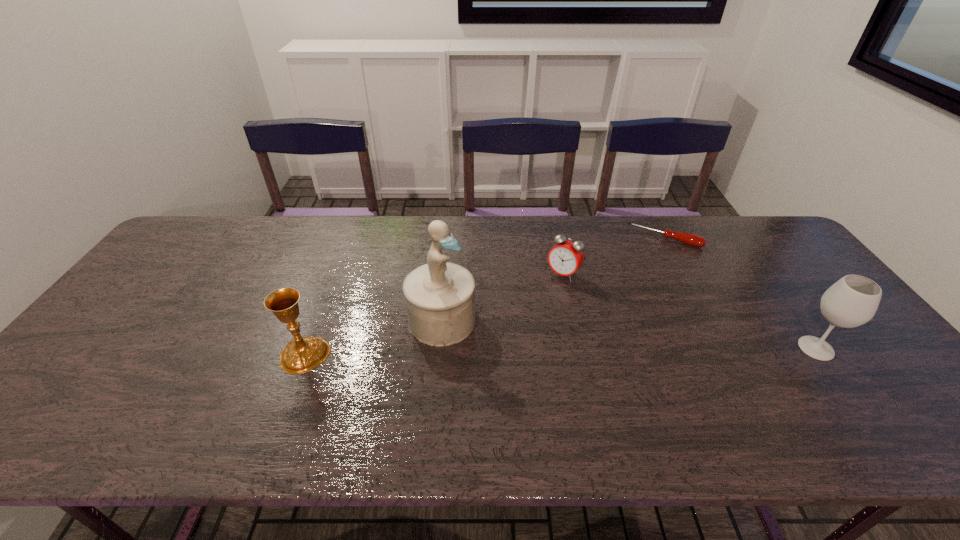
Identify the location of free space located 0.390m at the beak of the figurine. Image resolution: width=960 pixels, height=540 pixels. (618, 396).

The height and width of the screenshot is (540, 960). In order to click on blank area located 0.290m at the beak of the figurine in this screenshot , I will do tap(577, 378).

The width and height of the screenshot is (960, 540). What are the coordinates of `free region located 0.190m at the beak of the figurine` in the screenshot? It's located at (538, 361).

This screenshot has height=540, width=960. What are the coordinates of `vacant space located on the front-facing side of the third object from left to right` in the screenshot? It's located at (540, 300).

The width and height of the screenshot is (960, 540). Identify the location of free space located on the front-facing side of the third object from left to right. (538, 305).

Locate an element on the screen. Image resolution: width=960 pixels, height=540 pixels. free space located 0.320m on the front-facing side of the third object from left to right is located at coordinates (497, 353).

At what (x,y) coordinates should I click in order to perform the action: click on blank space located 0.230m at the tip of the screwdriver. Please return your answer as a coordinate pair (x, y). Image resolution: width=960 pixels, height=540 pixels. Looking at the image, I should click on (636, 292).

This screenshot has width=960, height=540. Find the location of `vacant position located at the tip of the screwdriver`. vacant position located at the tip of the screwdriver is located at coordinates (623, 325).

The width and height of the screenshot is (960, 540). In order to click on free space located 0.220m at the tip of the screwdriver in this screenshot , I will do `click(637, 289)`.

Image resolution: width=960 pixels, height=540 pixels. I want to click on object present at the far edge, so (693, 240).